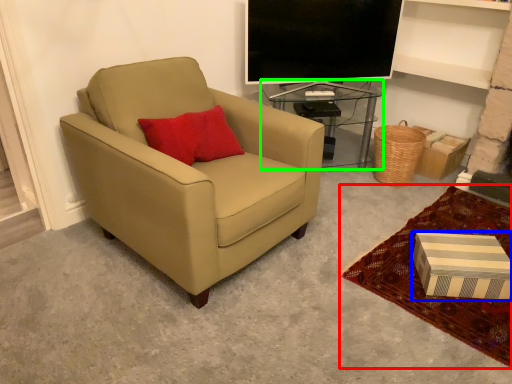
Question: Which object is positioned farthest from plain (highlighted by a red box)? Select from box (highlighted by a blue box) and table (highlighted by a green box).

Choices:
 (A) box
 (B) table

Answer: (B)